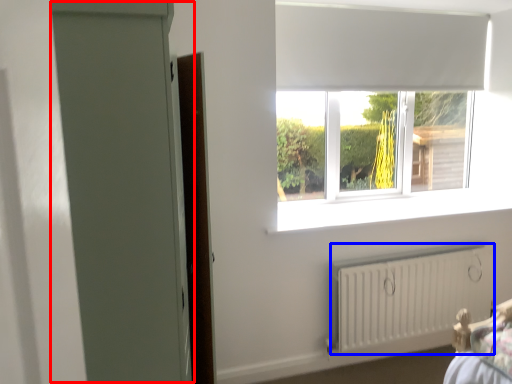
Question: Among these objects, which one is farthest to the camera, screen door (highlighted by a red box) or radiator (highlighted by a blue box)?

Choices:
 (A) screen door
 (B) radiator

Answer: (B)